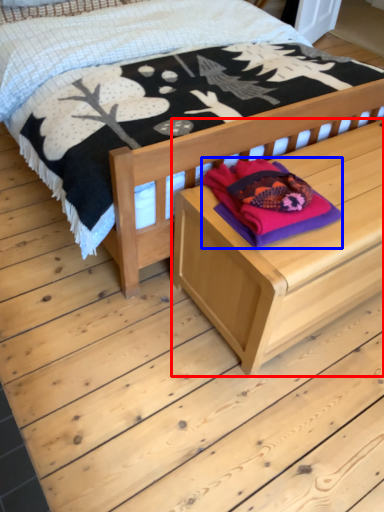
Question: Which object appears closest to the camera in this image, table (highlighted by a red box) or clothing (highlighted by a blue box)?

Choices:
 (A) table
 (B) clothing

Answer: (A)